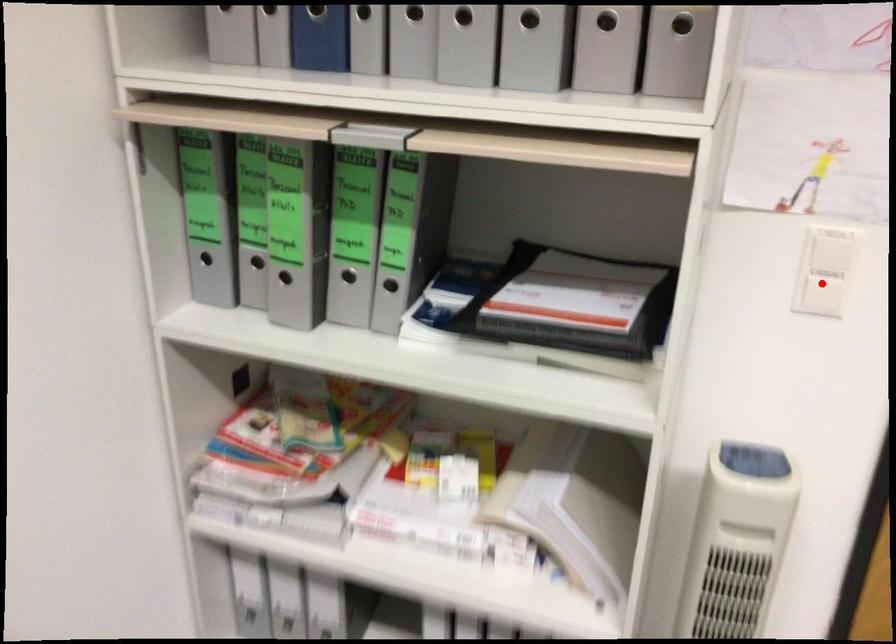
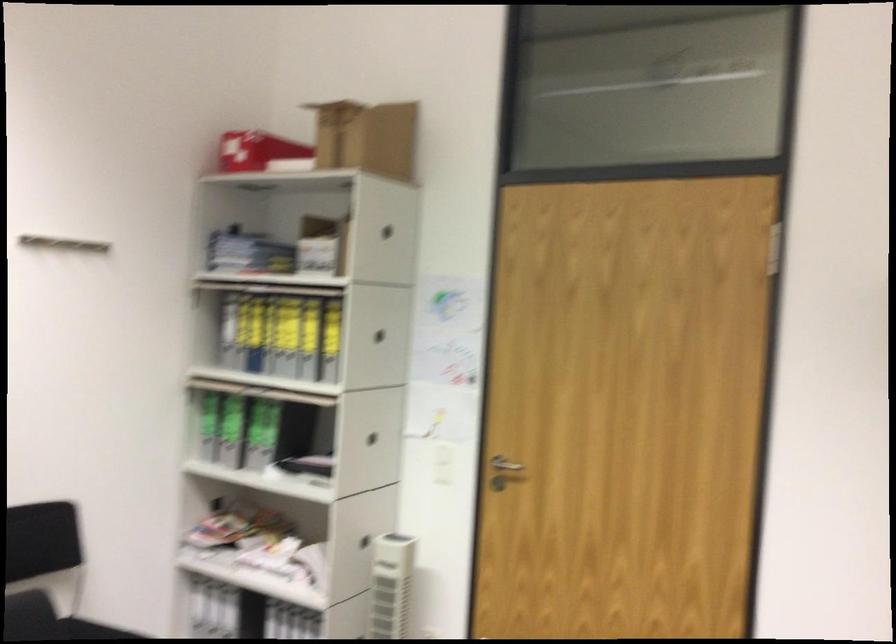
Locate, in the second image, the point that corresponds to the highlighted location in the first image.

(444, 462)